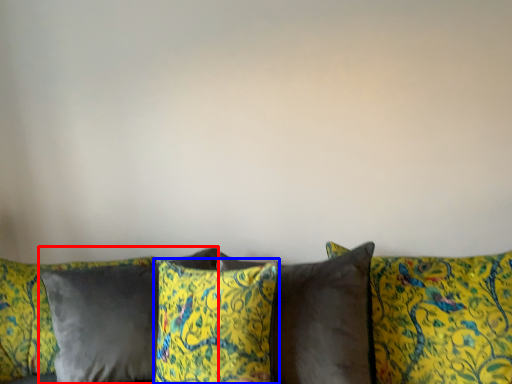
Question: Which object appears farthest to the camera in this image, pillow (highlighted by a red box) or pillow (highlighted by a blue box)?

Choices:
 (A) pillow
 (B) pillow

Answer: (A)